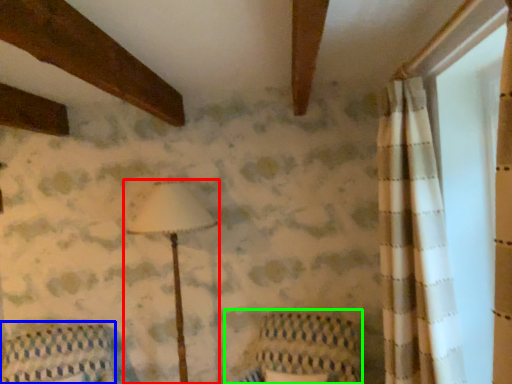
Question: Based on their relative distances, which object is farther from lamp (highlighted by a red box)? Choose from furniture (highlighted by a blue box) and armchair (highlighted by a green box).

Choices:
 (A) furniture
 (B) armchair

Answer: (A)